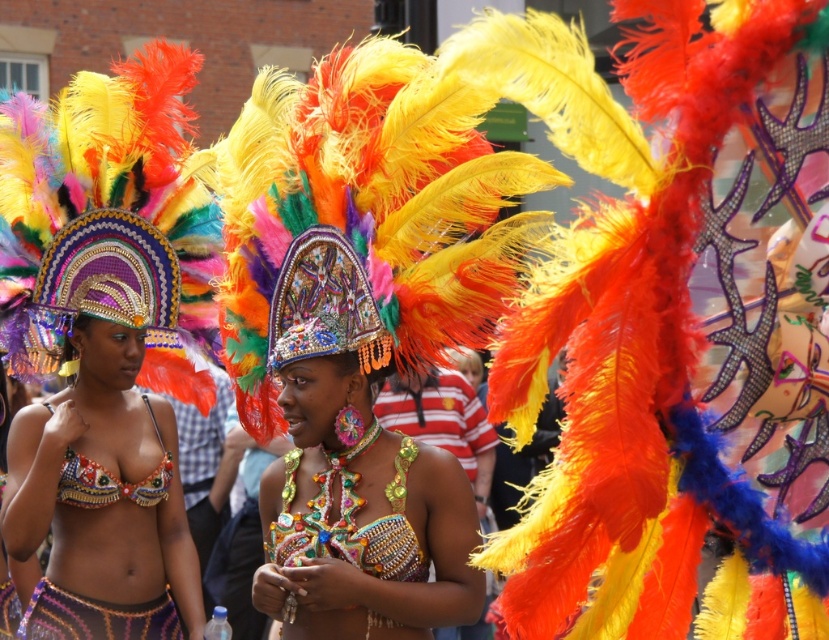
Is point (333, 372) positioned after point (86, 632)?

No, it is in front of (86, 632).

At what (x,y) coordinates should I click in order to perform the action: click on shiny sequined costume at center. Please return your answer as a coordinate pair (x, y). Image resolution: width=829 pixels, height=640 pixels. Looking at the image, I should click on (352, 472).

Image resolution: width=829 pixels, height=640 pixels. I want to click on shiny sequined costume at center, so click(352, 472).

Identify the location of shiny sequined costume at center. The image size is (829, 640). (352, 472).

Does multicolored sequined headdress at center appear on the left side of multicolored sequined bikini top at center?

Correct, you'll find multicolored sequined headdress at center to the left of multicolored sequined bikini top at center.

Describe the element at coordinates (109, 221) in the screenshot. I see `multicolored sequined headdress at center` at that location.

At what (x,y) coordinates should I click in order to perform the action: click on multicolored sequined headdress at center. Please return your answer as a coordinate pair (x, y). The height and width of the screenshot is (640, 829). Looking at the image, I should click on (109, 221).

Does multicolored sequined bikini top at center have a smaller size compared to beige sequined bikini top at center?

Correct, multicolored sequined bikini top at center occupies less space than beige sequined bikini top at center.

Who is more forward, [36,536] or [75,461]?

Point [36,536] is in front.

Is point (154, 467) more distant than point (161, 449)?

No.

You are a GUI agent. You are given a task and a screenshot of the screen. Output one action in this format:
    pyautogui.click(x=<x>, y=<y>)
    Task: Click on the multicolored sequined bikini top at center
    
    Given the screenshot: What is the action you would take?
    pyautogui.click(x=104, y=502)